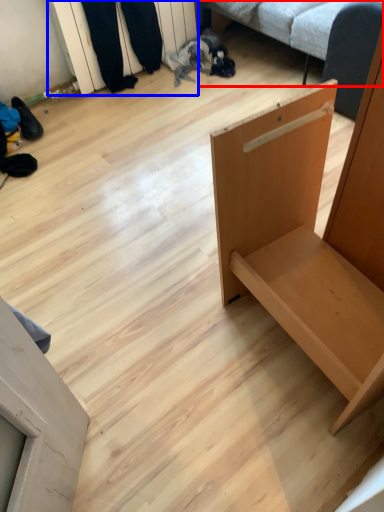
Question: Which of the following is the farthest to the observer, studio couch (highlighted by a red box) or shelf (highlighted by a blue box)?

Choices:
 (A) studio couch
 (B) shelf

Answer: (B)